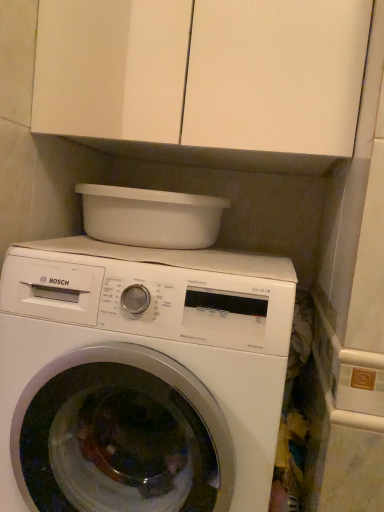
Identify the location of white glossy washing machine at center. This screenshot has width=384, height=512. (140, 377).

Where is `white glossy washing machine at center`? white glossy washing machine at center is located at coordinates (140, 377).

Which object is positioned more to the right, white plastic basin at upper center or white glossy washing machine at center?

white glossy washing machine at center.

Could you tell me if white plastic basin at upper center is turned towards white glossy washing machine at center?

No, white plastic basin at upper center is not facing towards white glossy washing machine at center.

Is white plastic basin at upper center not close to white glossy washing machine at center?

No, white plastic basin at upper center is not far away from white glossy washing machine at center.

Between white matte cabinet at upper center and white glossy washing machine at center, which one appears on the right side from the viewer's perspective?

white matte cabinet at upper center.

Is white matte cabinet at upper center facing away from white glossy washing machine at center?

No, white glossy washing machine at center is not at the back of white matte cabinet at upper center.

The width and height of the screenshot is (384, 512). In order to click on washing machine below the white matte cabinet at upper center (from the image's perspective) in this screenshot , I will do `click(140, 377)`.

In the scene shown: In terms of width, does white matte cabinet at upper center look wider or thinner when compared to white glossy washing machine at center?

In the image, white matte cabinet at upper center appears to be more narrow than white glossy washing machine at center.

Considering the sizes of white matte cabinet at upper center and white plastic basin at upper center in the image, is white matte cabinet at upper center taller or shorter than white plastic basin at upper center?

Considering their sizes, white matte cabinet at upper center has more height than white plastic basin at upper center.

Which is in front, white matte cabinet at upper center or white plastic basin at upper center?

white matte cabinet at upper center is in front.

Is white matte cabinet at upper center located outside white plastic basin at upper center?

Absolutely, white matte cabinet at upper center is external to white plastic basin at upper center.

Looking at this image, from the image's perspective, is white glossy washing machine at center under white matte cabinet at upper center?

Yes, from the image's perspective, white glossy washing machine at center is below white matte cabinet at upper center.

From a real-world perspective, which object rests below the other?

white glossy washing machine at center, from a real-world perspective.

Considering the relative sizes of white glossy washing machine at center and white matte cabinet at upper center in the image provided, is white glossy washing machine at center bigger than white matte cabinet at upper center?

Yes, white glossy washing machine at center is bigger than white matte cabinet at upper center.

Is white glossy washing machine at center at the left side of white plastic basin at upper center?

In fact, white glossy washing machine at center is to the right of white plastic basin at upper center.

Locate an element on the screen. washing machine lying below the white plastic basin at upper center (from the image's perspective) is located at coordinates (140, 377).

Considering the sizes of white glossy washing machine at center and white plastic basin at upper center in the image, is white glossy washing machine at center bigger or smaller than white plastic basin at upper center?

Clearly, white glossy washing machine at center is larger in size than white plastic basin at upper center.

From the image's perspective, which is below, white glossy washing machine at center or white plastic basin at upper center?

white glossy washing machine at center, from the image's perspective.

At what (x,y) coordinates should I click in order to perform the action: click on appliance located underneath the white matte cabinet at upper center (from a real-world perspective). Please return your answer as a coordinate pair (x, y). This screenshot has height=512, width=384. Looking at the image, I should click on (150, 217).

Which of these two, white plastic basin at upper center or white matte cabinet at upper center, stands taller?

white matte cabinet at upper center.

How much distance is there between white plastic basin at upper center and white matte cabinet at upper center?

white plastic basin at upper center and white matte cabinet at upper center are 10.43 inches apart.

Identify the location of washing machine below the white plastic basin at upper center (from a real-world perspective). (140, 377).

Identify the location of washing machine on the left of white matte cabinet at upper center. tap(140, 377).

Looking at this image, which object lies nearer to the anchor point white matte cabinet at upper center, white plastic basin at upper center or white glossy washing machine at center?

white plastic basin at upper center is closer to white matte cabinet at upper center.

Which object lies nearer to the anchor point white glossy washing machine at center, white matte cabinet at upper center or white plastic basin at upper center?

Based on the image, white plastic basin at upper center appears to be nearer to white glossy washing machine at center.

From the image, which object appears to be nearer to white matte cabinet at upper center, white glossy washing machine at center or white plastic basin at upper center?

Based on the image, white plastic basin at upper center appears to be nearer to white matte cabinet at upper center.

Looking at the image, which one is located further to white glossy washing machine at center, white plastic basin at upper center or white matte cabinet at upper center?

Based on the image, white matte cabinet at upper center appears to be further to white glossy washing machine at center.

Looking at the image, which one is located closer to white plastic basin at upper center, white matte cabinet at upper center or white glossy washing machine at center?

The object closer to white plastic basin at upper center is white matte cabinet at upper center.

When comparing their distances from white plastic basin at upper center, does white glossy washing machine at center or white matte cabinet at upper center seem closer?

white matte cabinet at upper center.

Where is `appliance that lies between white matte cabinet at upper center and white glossy washing machine at center from top to bottom`? The image size is (384, 512). appliance that lies between white matte cabinet at upper center and white glossy washing machine at center from top to bottom is located at coordinates (150, 217).